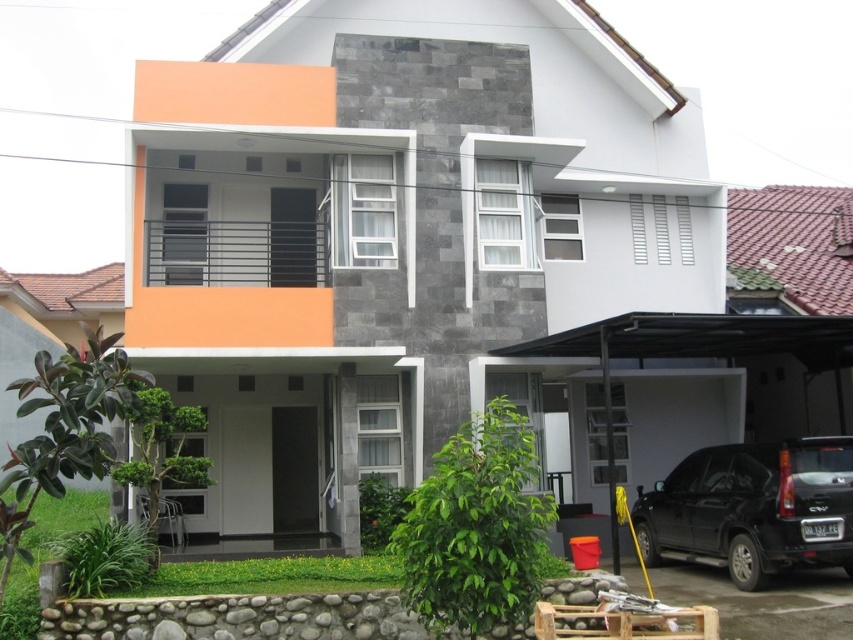
Between white concrete garage at lower right and black matte suv at lower right, which one has more height?

Standing taller between the two is white concrete garage at lower right.

Is point (519, 56) positioned in front of point (809, 483)?

No, (519, 56) is behind (809, 483).

Is point (456, 230) positioned in front of point (701, 536)?

No, it is not.

Locate an element on the screen. The height and width of the screenshot is (640, 853). white concrete garage at lower right is located at coordinates (395, 228).